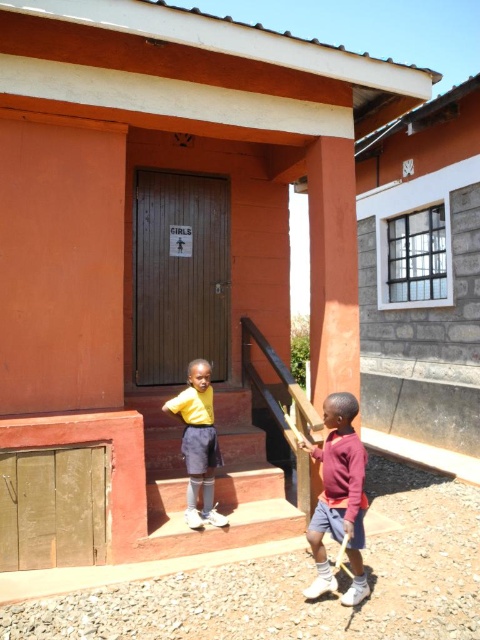
You are a visitor trying to enter the building and see the orange matte pillar at upper center and the maroon sweater at lower right. Which object is closer to the entrance of the building?

The orange matte pillar at upper center is closer to the entrance of the building because the maroon sweater at lower right is behind it.

Looking at this image, you are a parent trying to find the girls bathroom. You see the orange matte pillar at upper center and the maroon sweater at lower right. Which object is closer to the door labeled GIRLS?

The maroon sweater at lower right is closer to the door labeled GIRLS because it is positioned lower than the orange matte pillar at upper center, which is much taller and located higher up.

You are a parent trying to pick up your child from school. Your child is wearing a maroon sweater at lower right. The other child is standing on the steps leading up to the building. How far apart are the two children?

The two children are 3.21 meters apart.